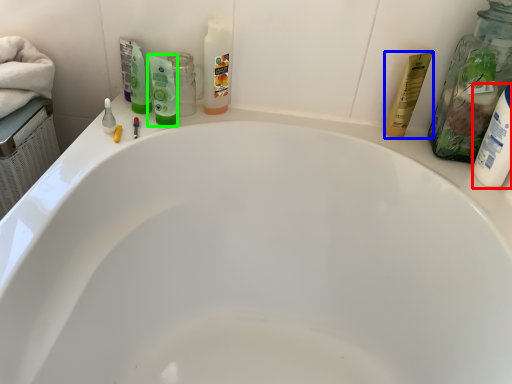
Question: Based on their relative distances, which object is nearer to toiletry (highlighted by a red box)? Choose from toiletry (highlighted by a blue box) and mouthwash (highlighted by a green box).

Choices:
 (A) toiletry
 (B) mouthwash

Answer: (A)